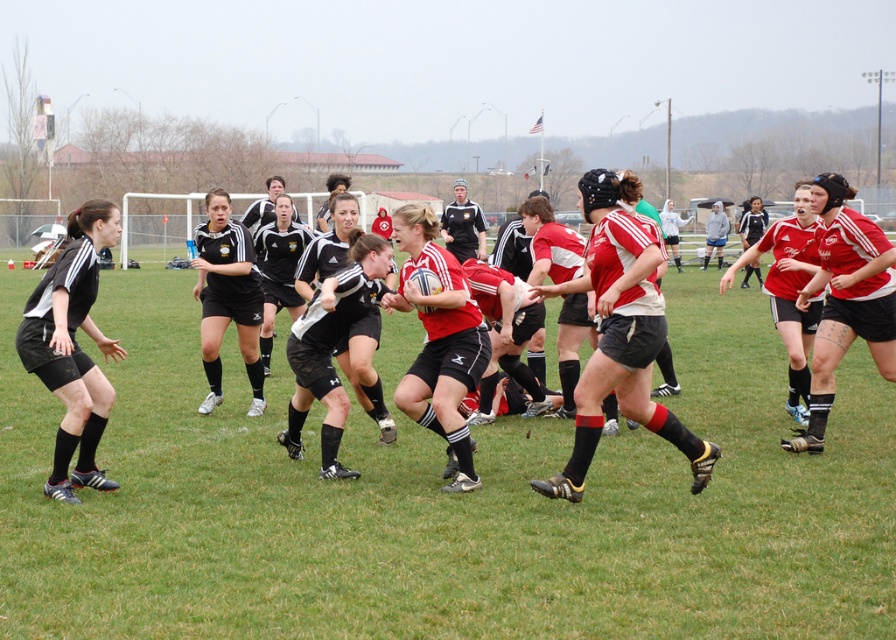
You are a photographer standing at the edge of the field capturing this rugby scrum. You notice the green grass football field at center and the black matte shorts at left. Which object is positioned closer to your camera lens?

The green grass football field at center is closer to the viewer than the black matte shorts at left, so the green grass football field at center would be closer to your camera lens.

You are a rugby player wearing the black matte shorts at left. You need to pass the ball to a teammate standing on the green grass football field at center. Which direction should you move to reach the field?

The green grass football field at center is positioned under the black matte shorts at left, so you should move downward to reach the field.

You are a rugby player preparing to join the scrum. You notice the green grass football field at center and the black matte shorts at left. Which object is larger in size?

The green grass football field at center is bigger than the black matte shorts at left, so the green grass football field at center is larger in size.